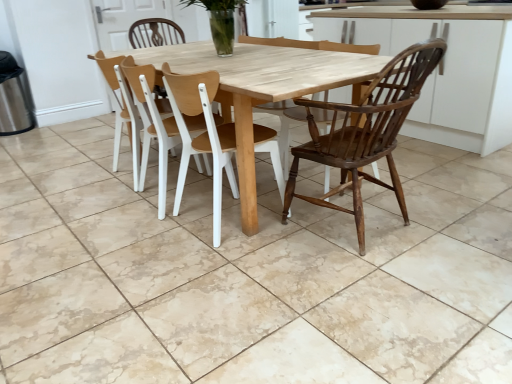
Locate an element on the screen. Image resolution: width=512 pixels, height=384 pixels. free space to the left of wooden chair at center, the 2th chair from the right is located at coordinates (139, 235).